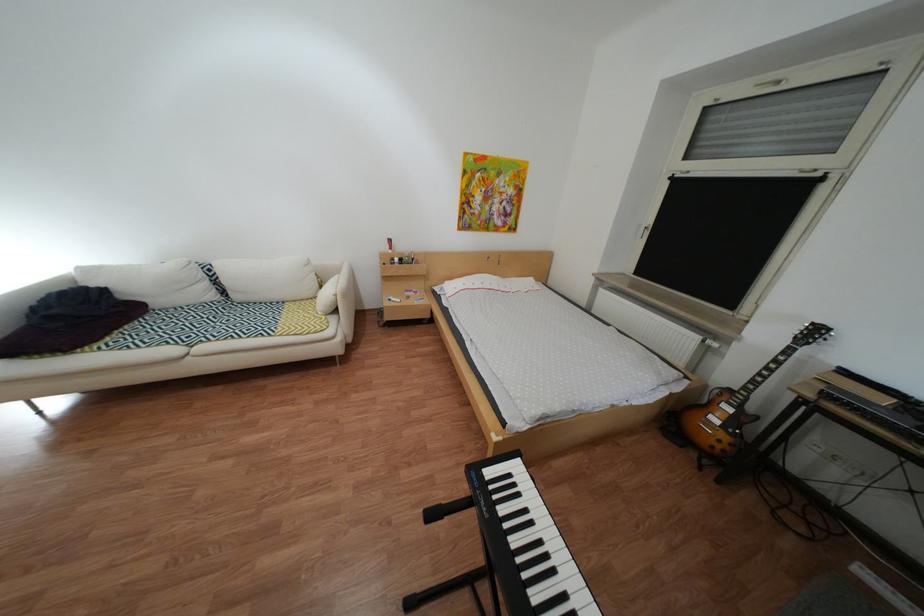
This screenshot has height=616, width=924. Find the location of `white window handle`. white window handle is located at coordinates (771, 84).